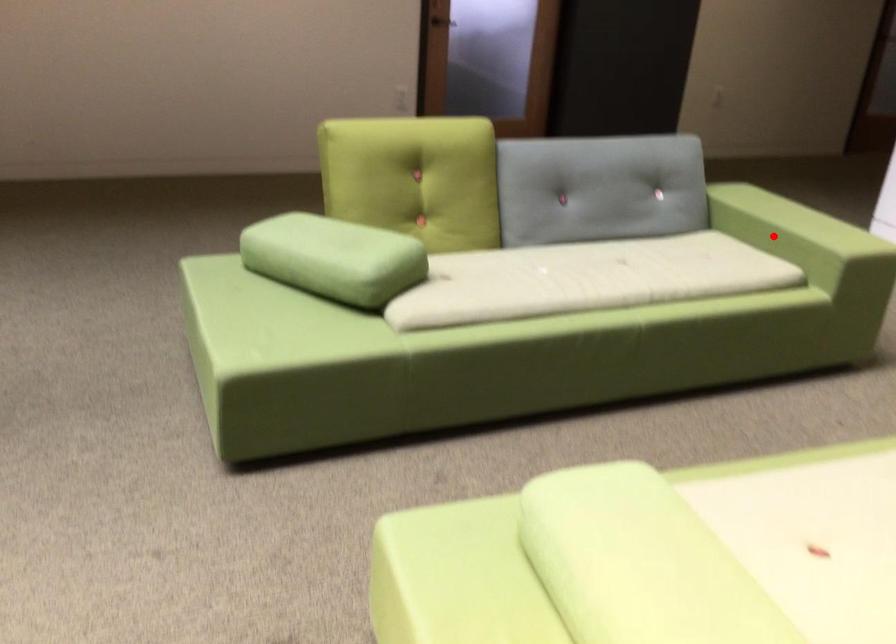
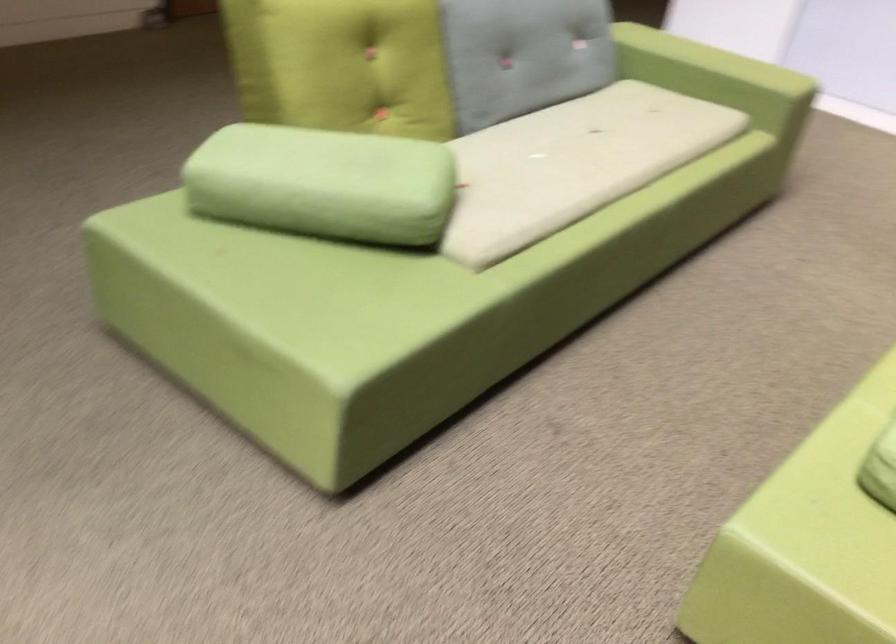
Find the pixel in the second image that matches the highlighted location in the first image.

(717, 77)